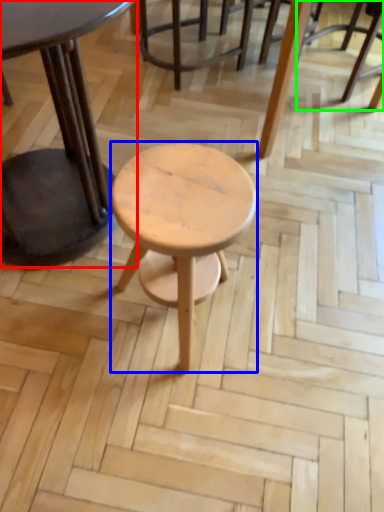
Question: Which is nearer to the table (highlighted by a red box)? stool (highlighted by a blue box) or chair (highlighted by a green box).

Choices:
 (A) stool
 (B) chair

Answer: (A)